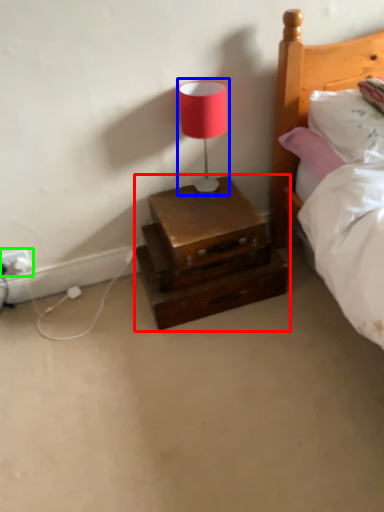
Question: Which is farther away from nightstand (highlighted by a red box)? table lamp (highlighted by a blue box) or electric outlet (highlighted by a green box)?

Choices:
 (A) table lamp
 (B) electric outlet

Answer: (B)